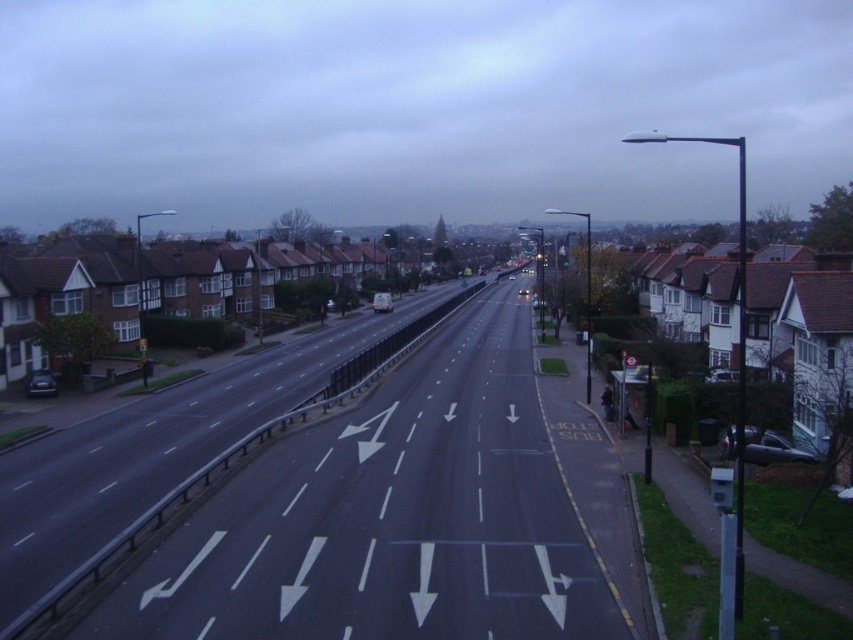
Question: Which of these objects is positioned closest to the metallic silver car at center?

Choices:
 (A) matte black car at left
 (B) metallic silver car at right
 (C) black asphalt highway at center

Answer: (B)

Question: Among these objects, which one is farthest from the camera?

Choices:
 (A) metallic silver car at center
 (B) metallic silver car at right

Answer: (A)

Question: Does matte black car at left appear under metallic silver car at center?

Choices:
 (A) no
 (B) yes

Answer: (B)

Question: Is metallic silver car at right thinner than metallic silver car at center?

Choices:
 (A) yes
 (B) no

Answer: (A)

Question: Considering the relative positions of black asphalt highway at center and metallic silver car at right in the image provided, where is black asphalt highway at center located with respect to metallic silver car at right?

Choices:
 (A) below
 (B) above

Answer: (B)

Question: Which object is positioned closest to the metallic silver car at center?

Choices:
 (A) metallic silver car at right
 (B) black asphalt highway at center

Answer: (A)